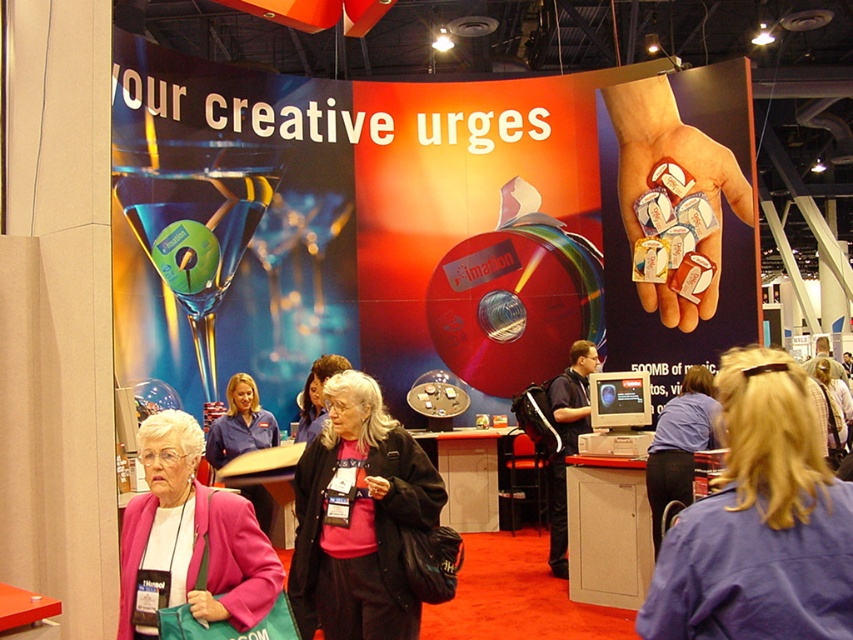
What is the color of the fabric at the point with coordinates (189, 540) in the image?

The point at coordinates (189, 540) is on the pink fabric jacket at lower left, so the color is pink.

You are standing at the trade show booth and want to approach the point marked as point [152,464]. If you take three steps forward, each step covering 0.8 meters, will you reach the point?

The distance between you and point [152,464] is 3.20 meters. Taking three steps of 0.8 meters each would cover 2.4 meters. Since 2.4 meters is less than 3.20 meters, you will not reach the point.